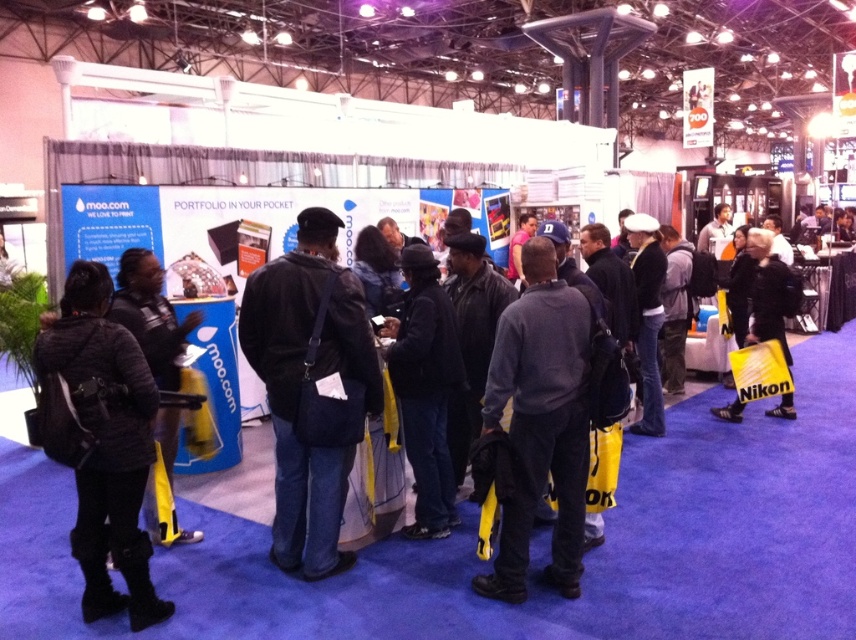
Question: Does dark gray sweater at center have a larger size compared to black leather jacket at right?

Choices:
 (A) yes
 (B) no

Answer: (B)

Question: Which object appears farthest from the camera in this image?

Choices:
 (A) black leather jacket at left
 (B) black leather jacket at right

Answer: (B)

Question: Which object appears farthest from the camera in this image?

Choices:
 (A) dark gray sweater at center
 (B) black leather jacket at right
 (C) dark blue leather jacket at center
 (D) black leather jacket at left

Answer: (B)

Question: Does dark blue leather jacket at center come in front of black leather jacket at right?

Choices:
 (A) no
 (B) yes

Answer: (B)

Question: Which point is farther from the camera taking this photo?

Choices:
 (A) (770, 330)
 (B) (553, 416)
 (C) (195, 317)

Answer: (A)

Question: Is dark gray sweater at center smaller than black quilted jacket at left?

Choices:
 (A) no
 (B) yes

Answer: (A)